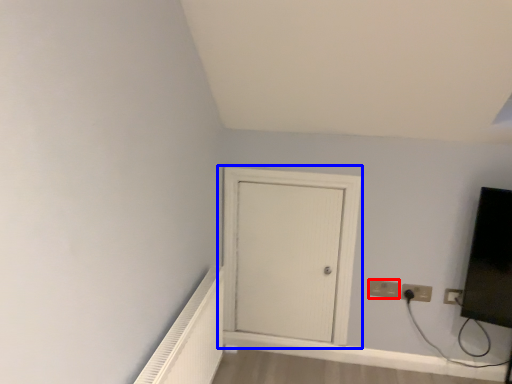
Question: Which object appears farthest to the camera in this image, electric outlet (highlighted by a red box) or door (highlighted by a blue box)?

Choices:
 (A) electric outlet
 (B) door

Answer: (A)